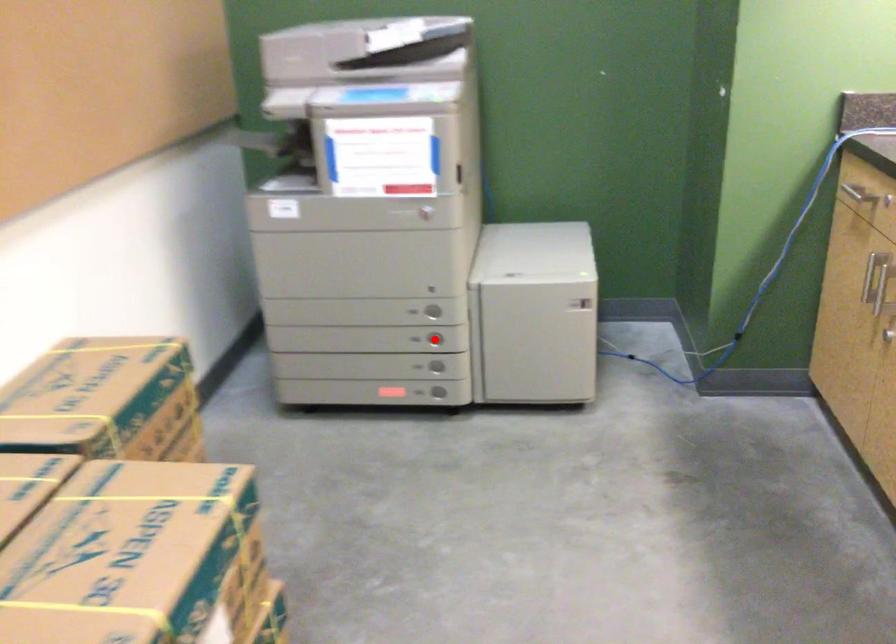
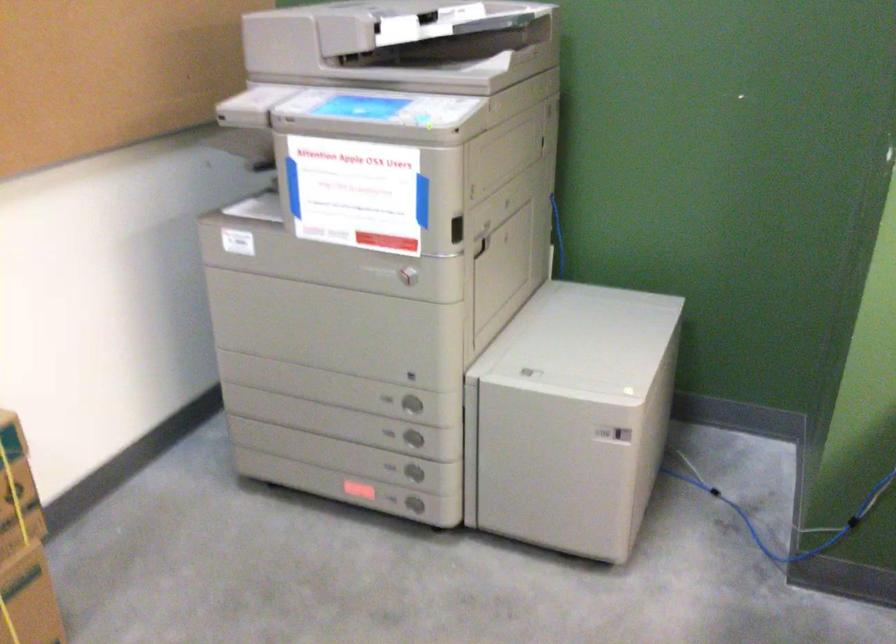
Find the pixel in the second image that matches the highlighted location in the first image.

(412, 438)